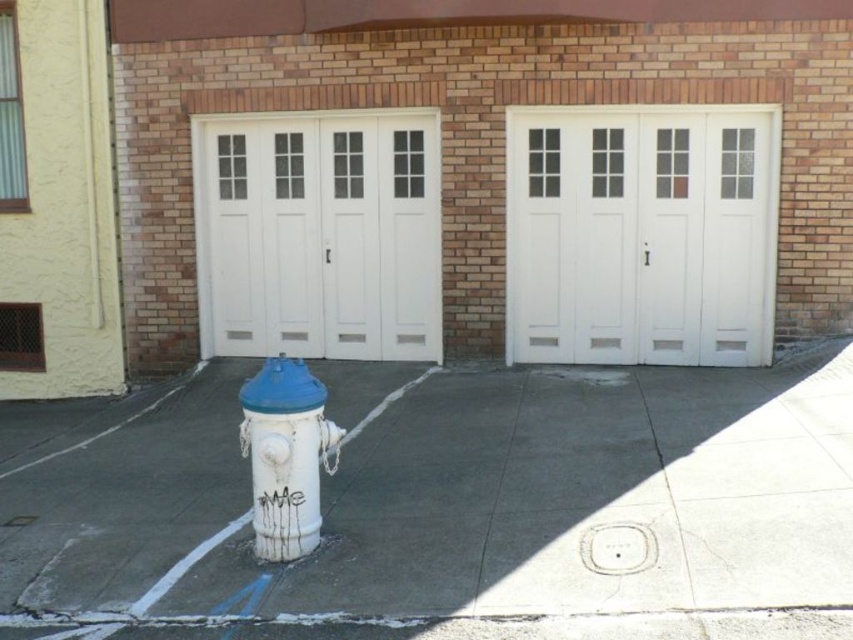
You are standing at the point marked by the coordinate [451,508] on the white concrete pavement at center. You want to walk to the fire hydrant painted white with a blue top. Which direction should you walk?

The fire hydrant painted white with a blue top is located in front of the garage doors, which are set into the brick wall. Since you are at the white concrete pavement at center, you should walk towards the garage doors and the brick wall to reach the fire hydrant.

You are a delivery person with a cart that is 2 meters wide. You need to park your cart between the white painted wood garage door at center and the white matte hydrant at lower left. Is there enough space for your cart?

The distance between the white painted wood garage door at center and the white matte hydrant at lower left is 4.60 meters. Since the cart is 2 meters wide, there is sufficient space to park the cart between them.